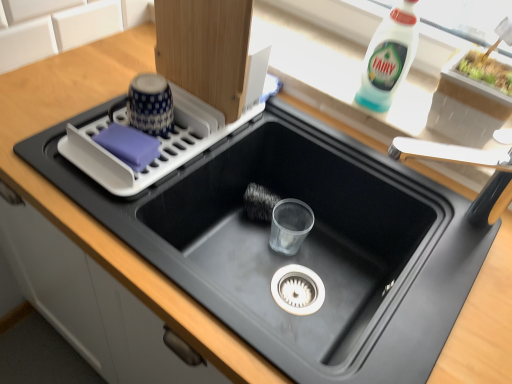
The image size is (512, 384). Identify the location of vacant space to the right of white plastic bottle at upper right. (415, 102).